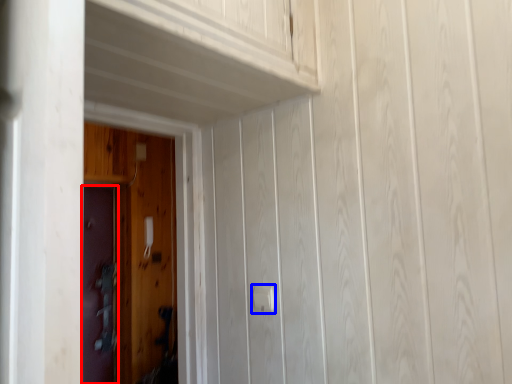
Question: Which of the following is the closest to the observer, door (highlighted by a red box) or door handle (highlighted by a blue box)?

Choices:
 (A) door
 (B) door handle

Answer: (B)